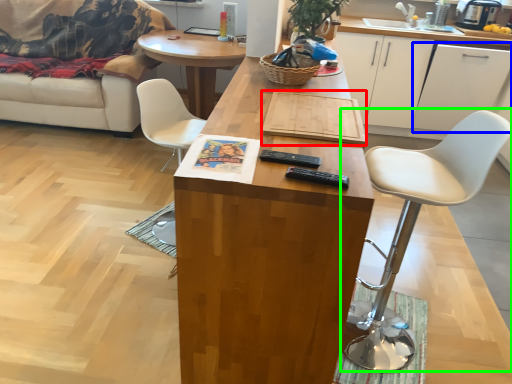
Question: Which object is positioned farthest from plank (highlighted by a red box)? Select from cabinetry (highlighted by a blue box) and chair (highlighted by a green box).

Choices:
 (A) cabinetry
 (B) chair

Answer: (A)